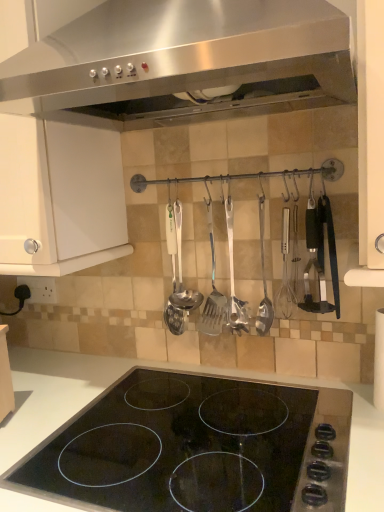
Question: Visually, is polished stainless steel spatula at center, marked as the 3th silverware in a left-to-right arrangement, positioned to the left or to the right of black glass stovetop at center?

Choices:
 (A) right
 (B) left

Answer: (A)

Question: In terms of size, does polished stainless steel spatula at center, marked as the 3th silverware in a left-to-right arrangement, appear bigger or smaller than black glass stovetop at center?

Choices:
 (A) big
 (B) small

Answer: (B)

Question: Which of these objects is positioned farthest from the polished stainless steel spatula at center, placed as the 2th silverware when sorted from right to left?

Choices:
 (A) white matte cabinet at upper left
 (B) polished metal ladle at center, marked as the first silverware in a right-to-left arrangement
 (C) metallic spatula at center, marked as the 3th silverware in a right-to-left arrangement
 (D) metallic silver ladle at center
 (E) black glass stovetop at center

Answer: (A)

Question: Estimate the real-world distances between objects in this image. Which object is closer to the white matte cabinet at upper left?

Choices:
 (A) polished stainless steel spatula at center, placed as the 2th silverware when sorted from right to left
 (B) metallic spatula at center, marked as the 3th silverware in a right-to-left arrangement
 (C) black glass stovetop at center
 (D) polished metal ladle at center, marked as the first silverware in a right-to-left arrangement
 (E) stainless steel range hood at upper center

Answer: (E)